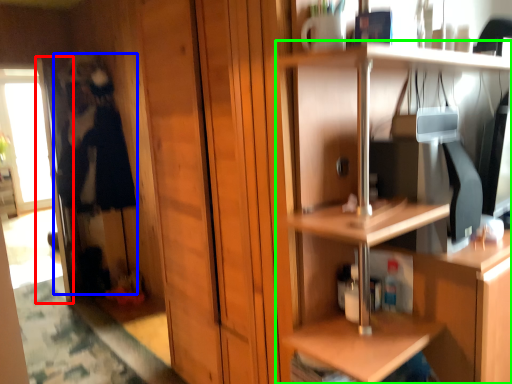
Question: Considering the real-world distances, which object is farthest from screen door (highlighted by a red box)? person (highlighted by a blue box) or shelf (highlighted by a green box)?

Choices:
 (A) person
 (B) shelf

Answer: (B)